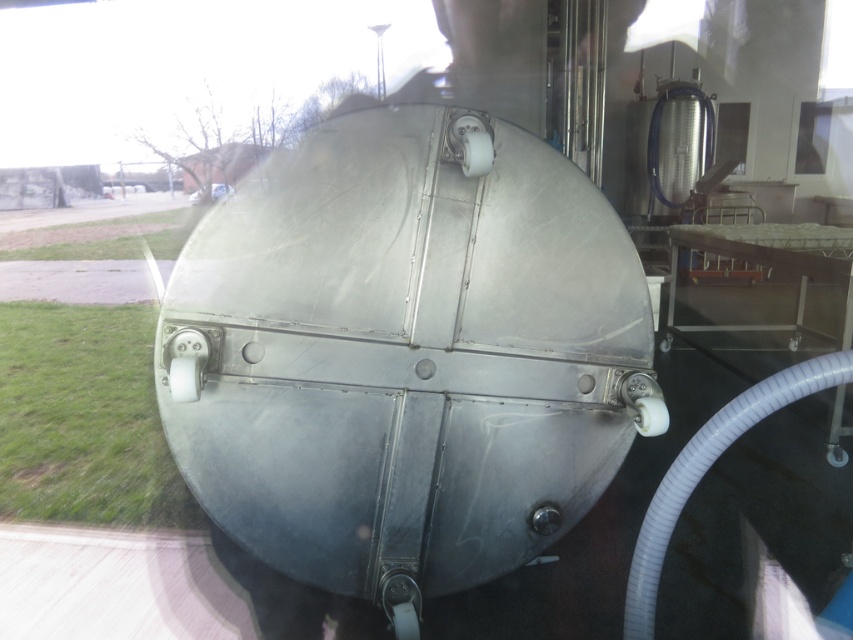
You are a maintenance worker inspecting the polished metallic tank at center and the transparent glass window at upper right. Which object is nearer to your current position?

The polished metallic tank at center is closer to the viewer than the transparent glass window at upper right, so the tank is nearer.

You are a maintenance worker standing 2 meters away from the polished metallic tank at center. Can you safely approach the tank without needing to move more than 0.5 meters forward?

The distance of polished metallic tank at center from viewer is 1.81 meters. Since you are standing 2 meters away, you need to move forward 0.19 meters to reach it, which is within the 0.5 meters limit. Yes, you can safely approach the tank without moving more than 0.5 meters forward.